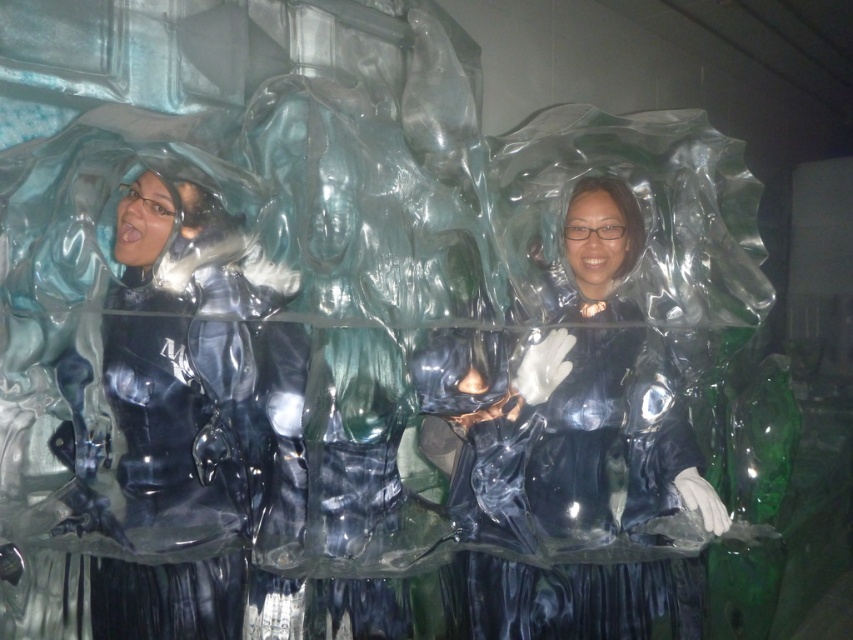
Question: Is transparent plastic person at center further to the viewer compared to transparent plastic figure at left?

Choices:
 (A) yes
 (B) no

Answer: (A)

Question: Is transparent plastic person at center positioned in front of transparent plastic figure at left?

Choices:
 (A) yes
 (B) no

Answer: (B)

Question: Which point is closer to the camera?

Choices:
 (A) transparent plastic figure at left
 (B) transparent plastic person at center

Answer: (A)

Question: Which point is farther to the camera?

Choices:
 (A) (563, 483)
 (B) (112, 465)

Answer: (A)

Question: Considering the relative positions of transparent plastic person at center and transparent plastic figure at left in the image provided, where is transparent plastic person at center located with respect to transparent plastic figure at left?

Choices:
 (A) above
 (B) below

Answer: (B)

Question: Which point is closer to the camera taking this photo?

Choices:
 (A) (585, 193)
 (B) (248, 308)

Answer: (B)